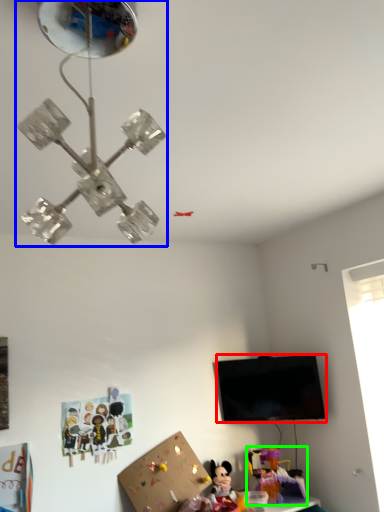
Question: Based on their relative distances, which object is nearer to television (highlighted by a red box)? Choose from lamp (highlighted by a blue box) and toy (highlighted by a green box).

Choices:
 (A) lamp
 (B) toy

Answer: (B)